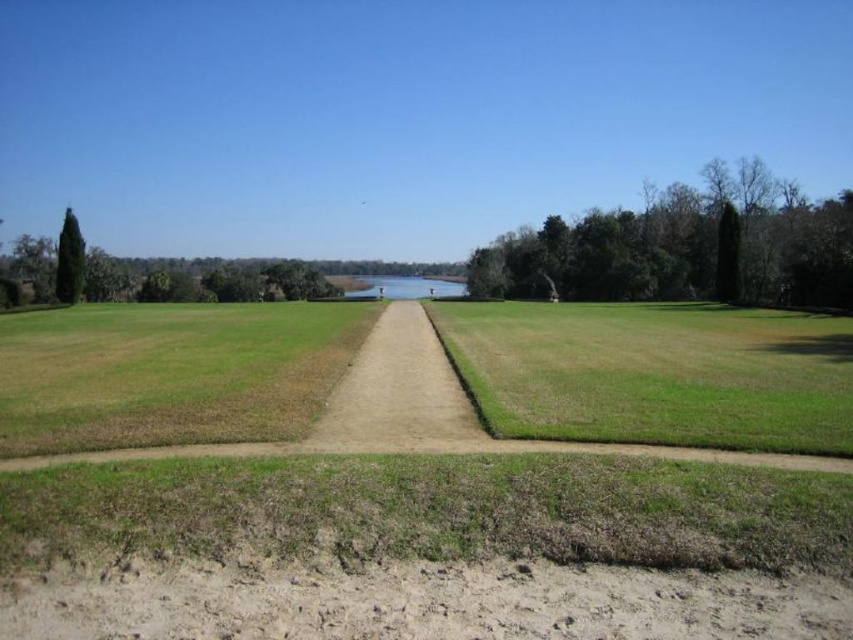
Which is behind, point (798, 243) or point (77, 298)?

Positioned behind is point (77, 298).

Does green leafy tree at right have a larger size compared to green matte tree at upper left?

Yes, green leafy tree at right is bigger than green matte tree at upper left.

Which is behind, point (495, 285) or point (83, 269)?

Positioned behind is point (495, 285).

Locate an element on the screen. The image size is (853, 640). green leafy tree at right is located at coordinates (683, 248).

This screenshot has width=853, height=640. What do you see at coordinates (426, 604) in the screenshot? I see `green grass at center` at bounding box center [426, 604].

Is point (392, 397) behind point (728, 400)?

Yes.

What are the coordinates of `green grass at center` in the screenshot? It's located at [x=426, y=604].

Does green grass at center have a lesser height compared to green matte tree at upper left?

Yes.

Can you confirm if green grass at center is bigger than green matte tree at upper left?

Actually, green grass at center might be smaller than green matte tree at upper left.

At what (x,y) coordinates should I click in order to perform the action: click on green grass at center. Please return your answer as a coordinate pair (x, y). The height and width of the screenshot is (640, 853). Looking at the image, I should click on (426, 604).